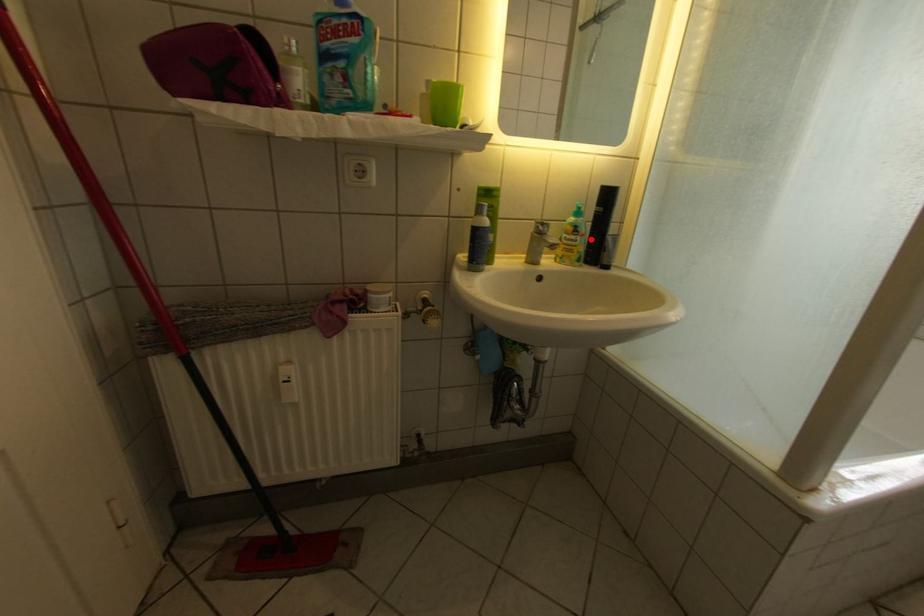
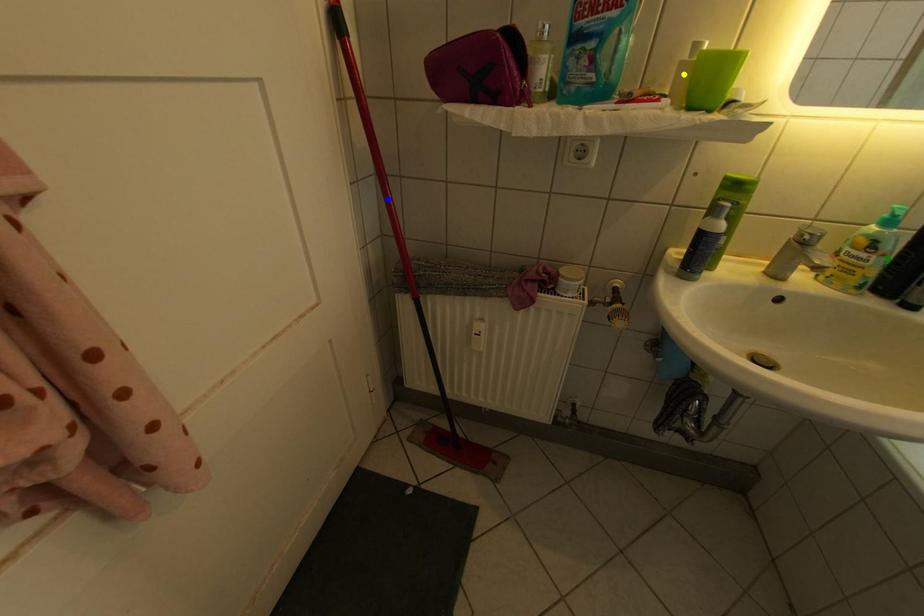
Question: I am providing you with two images of the same scene from different viewpoints. A red point is marked on the first image. You are given multiple points on the second image. Which point in image 2 is actually the same real-world point as the red point in image 1?

Choices:
 (A) blue point
 (B) yellow point
 (C) green point

Answer: (C)